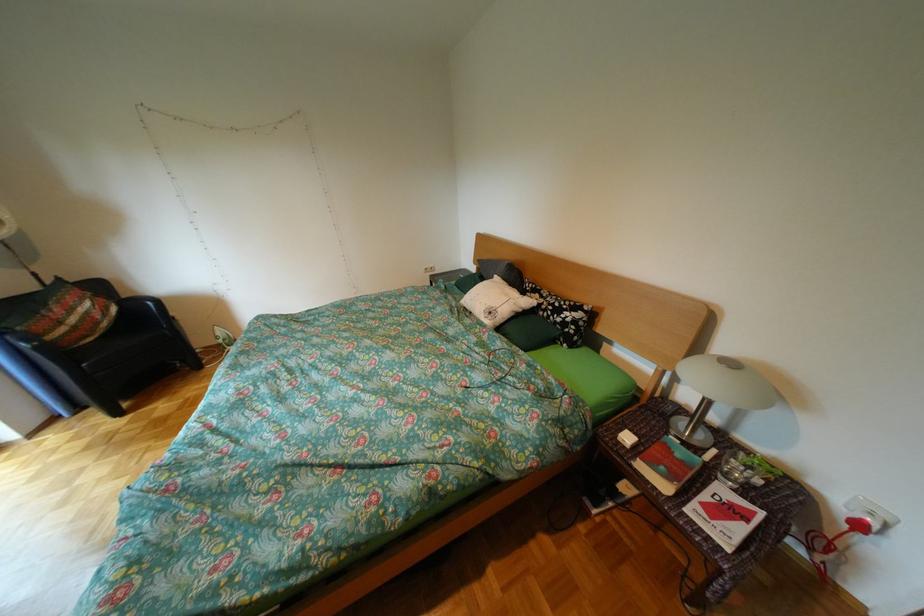
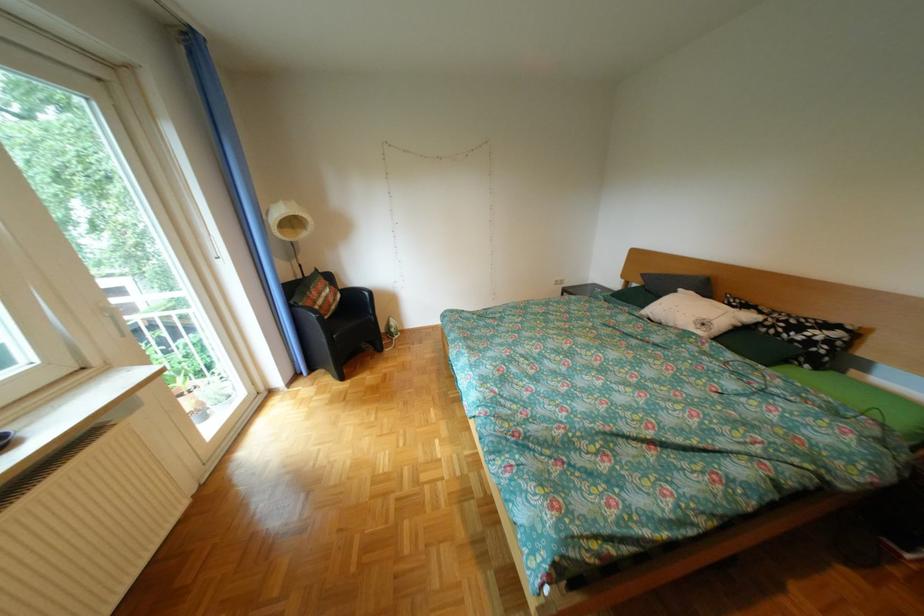
The point at (x=555, y=297) is marked in the first image. Where is the corresponding point in the second image?

(775, 313)